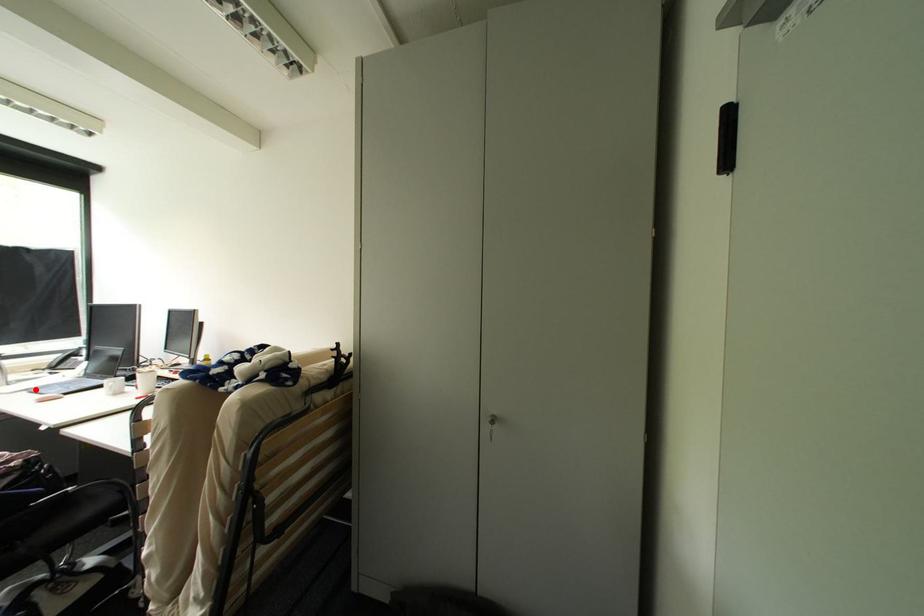
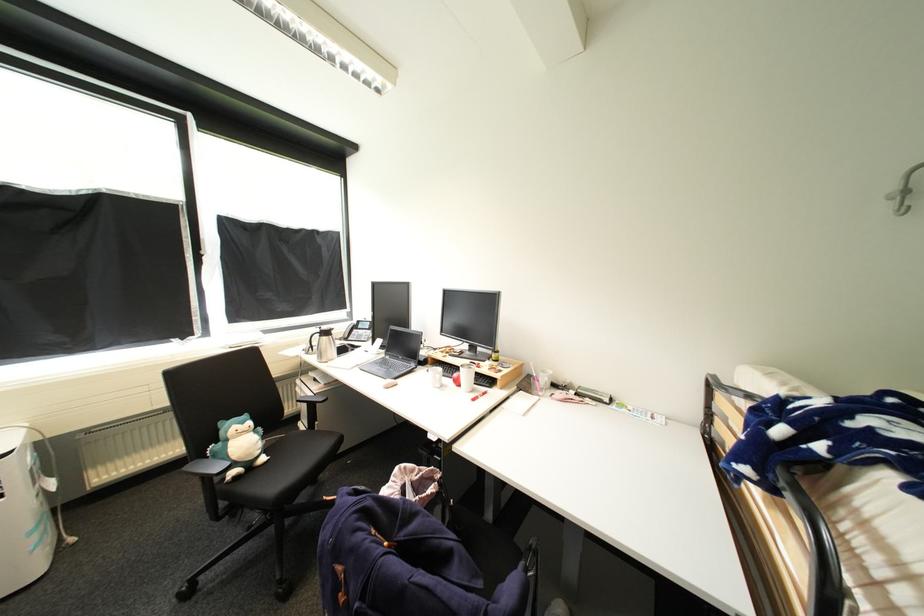
Question: I am providing you with two images of the same scene from different viewpoints. In image1, a red point is highlighted. Considering the same 3D point in image2, which of the following is correct?

Choices:
 (A) It is closer
 (B) It is farther

Answer: (B)